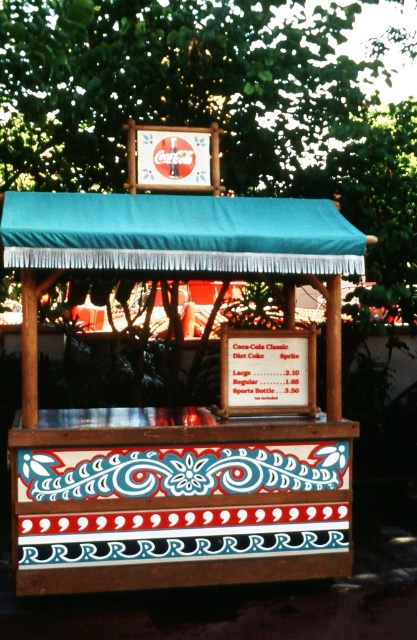
You are a customer standing in front of the beverage cart. You notice the wooden at center and the teal fabric canopy at upper center. Which object is positioned to the right side?

The wooden at center is positioned to the right of the teal fabric canopy at upper center.

You are a customer looking at the beverage cart. The wooden at center and the teal fabric canopy at upper center are both part of the cart. Which part of the cart takes up more space?

The wooden at center takes up more space than the teal fabric canopy at upper center because it is bigger.

You are standing in front of the beverage cart and want to grab the item at point (279, 557). Is it within your reach?

The point (279, 557) is 20.05 feet away from the camera, so it is too far to reach.